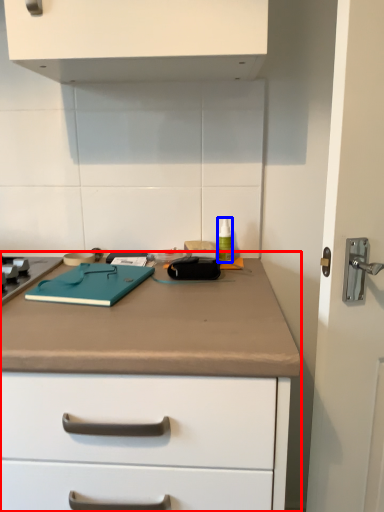
Question: Which object is closer to the camera taking this photo, counter (highlighted by a red box) or bottle (highlighted by a blue box)?

Choices:
 (A) counter
 (B) bottle

Answer: (A)